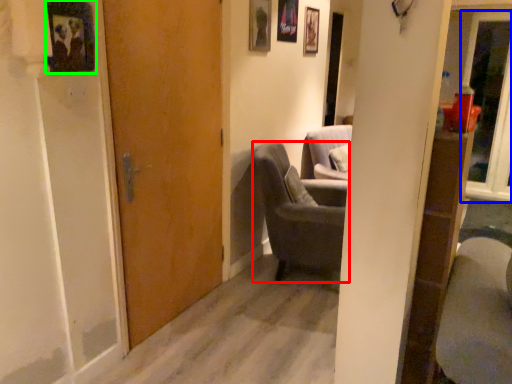
Question: Estimate the real-world distances between objects in this image. Which object is closer to chair (highlighted by a red box), glass door (highlighted by a blue box) or picture frame (highlighted by a green box)?

Choices:
 (A) glass door
 (B) picture frame

Answer: (B)